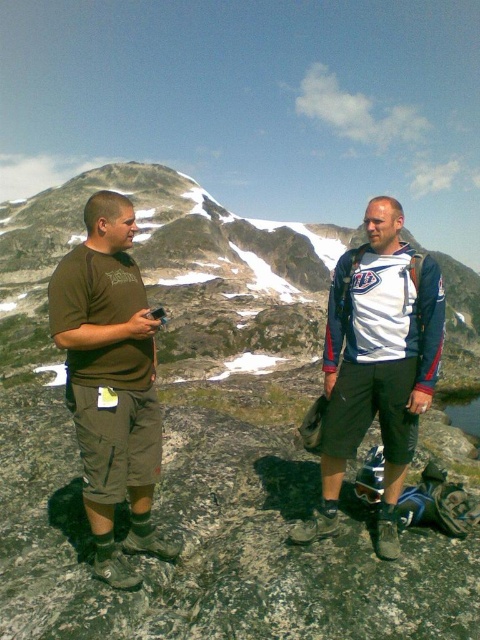
Question: Which point is closer to the camera?

Choices:
 (A) white jersey at center
 (B) matte brown rock at center

Answer: (A)

Question: Which point is farther from the camera taking this photo?

Choices:
 (A) (403, 480)
 (B) (79, 348)
 (C) (231, 234)

Answer: (C)

Question: Does brown cotton t-shirt at left have a larger size compared to white jersey at center?

Choices:
 (A) no
 (B) yes

Answer: (A)

Question: Which of these objects is positioned farthest from the matte brown rock at center?

Choices:
 (A) brown cotton t-shirt at left
 (B) white jersey at center

Answer: (B)

Question: Can you confirm if matte brown rock at center is positioned to the right of brown cotton t-shirt at left?

Choices:
 (A) yes
 (B) no

Answer: (A)

Question: Does matte brown rock at center have a smaller size compared to white jersey at center?

Choices:
 (A) yes
 (B) no

Answer: (B)